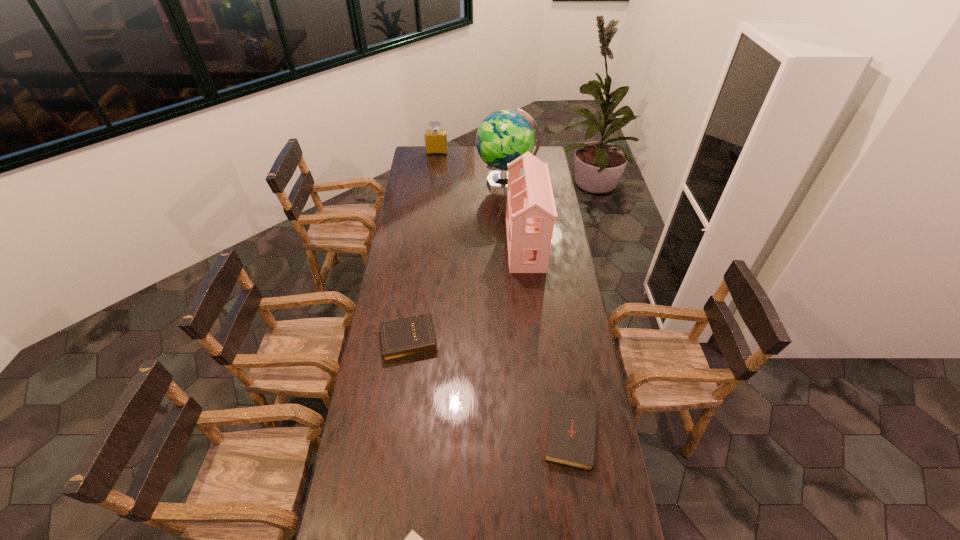
Identify the location of blank area in the image that satisfies the following two spatial constraints: 1. on the front-facing side of the second farthest Bible; 2. on the right side of the dollhouse. (545, 430).